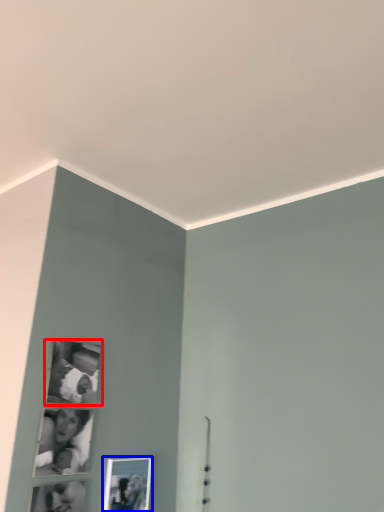
Question: Which of the following is the farthest to the observer, picture frame (highlighted by a red box) or picture frame (highlighted by a blue box)?

Choices:
 (A) picture frame
 (B) picture frame

Answer: (B)